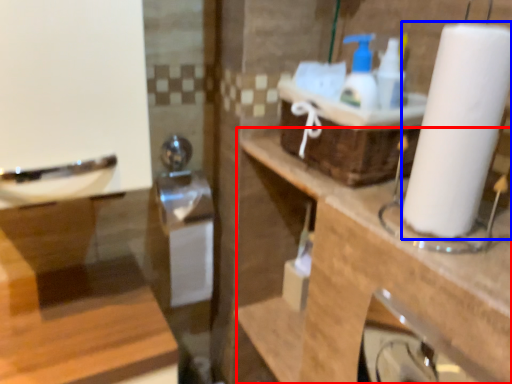
Question: Which object appears closest to the camera in this image, counter top (highlighted by a red box) or paper towel (highlighted by a blue box)?

Choices:
 (A) counter top
 (B) paper towel

Answer: (B)